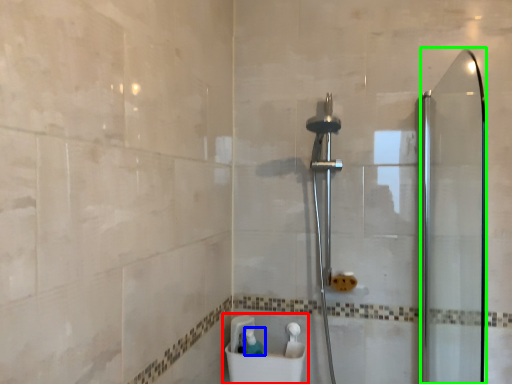
Question: Which object is the closest to the sink (highlighted by a red box)? Choose among these: toiletry (highlighted by a blue box) or screen door (highlighted by a green box).

Choices:
 (A) toiletry
 (B) screen door

Answer: (A)